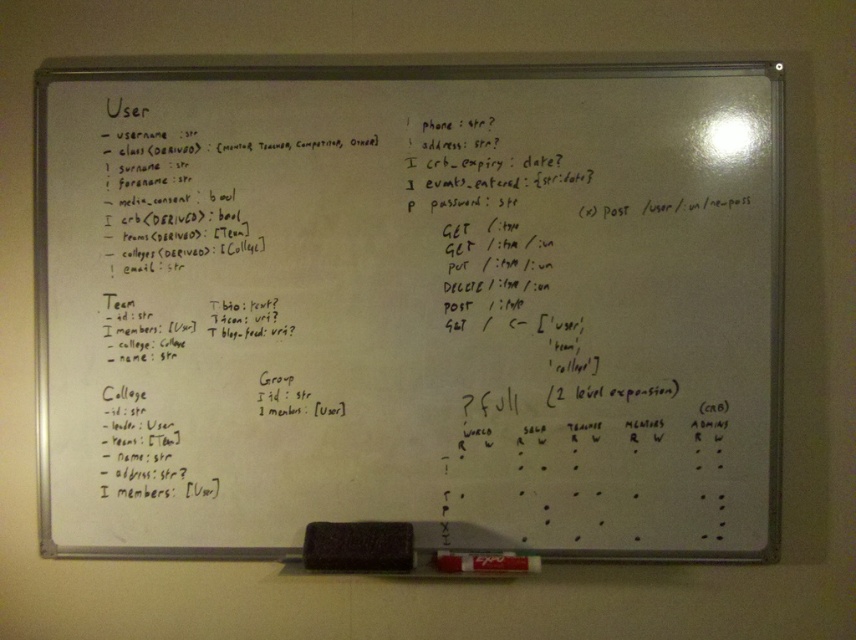
The image size is (856, 640). I want to click on whiteboard at center, so click(409, 307).

Who is positioned more to the right, whiteboard at center or black matte marker at bottom?

From the viewer's perspective, whiteboard at center appears more on the right side.

Is point (169, 243) closer to viewer compared to point (360, 524)?

That is False.

This screenshot has height=640, width=856. Identify the location of whiteboard at center. (409, 307).